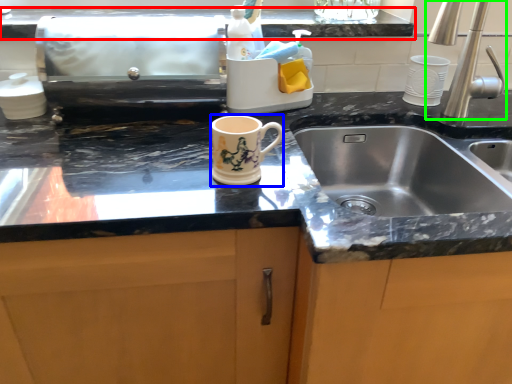
Question: Which object is positioned farthest from countertop (highlighted by a red box)? Select from mug (highlighted by a blue box) and tap (highlighted by a green box).

Choices:
 (A) mug
 (B) tap

Answer: (A)